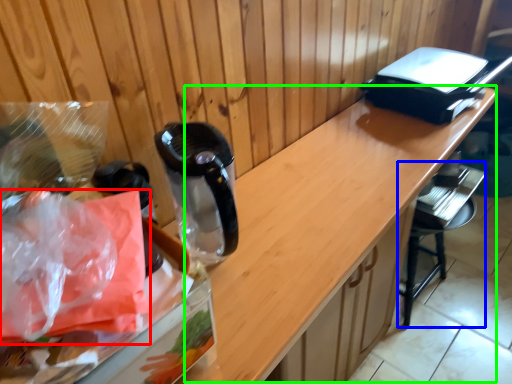
Question: Estimate the real-world distances between objects in this image. Which object is closer to plastic bag (highlighted by a red box), bar stool (highlighted by a blue box) or counter (highlighted by a green box)?

Choices:
 (A) bar stool
 (B) counter

Answer: (B)